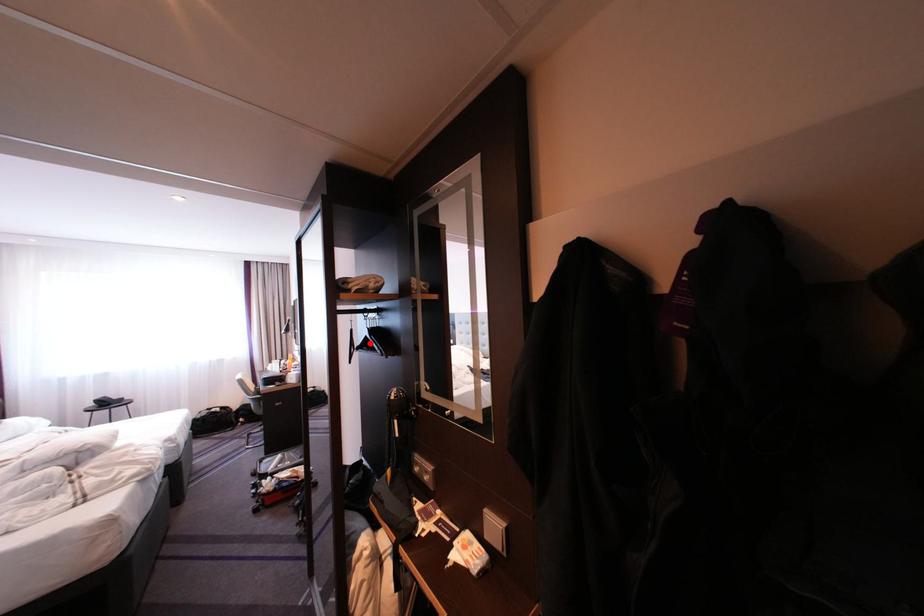
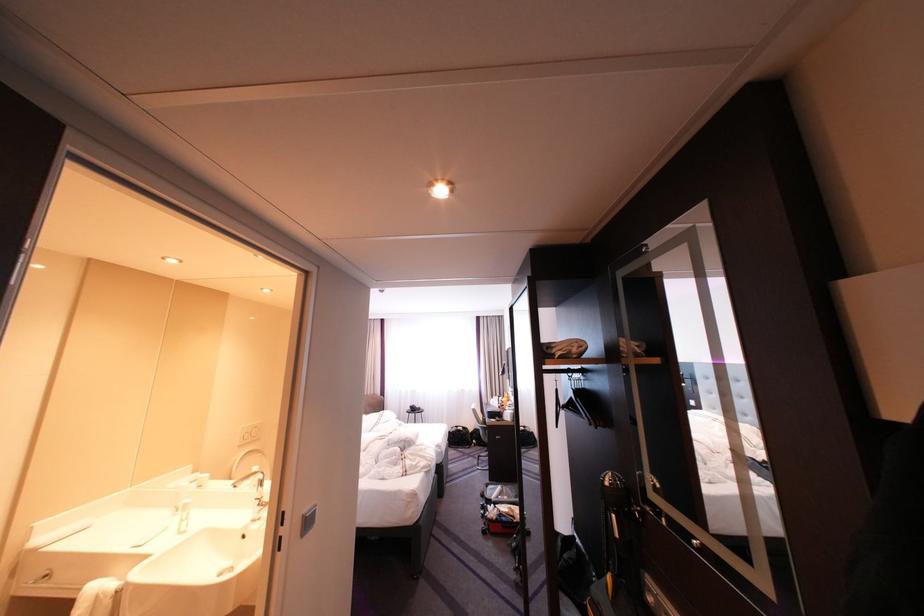
Find the pixel in the second image that matches the highlighted location in the first image.

(576, 402)